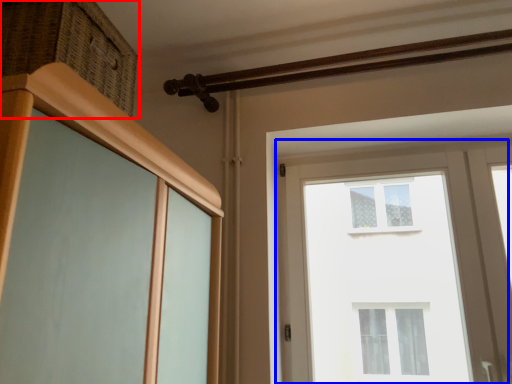
Question: Which point is further to the camera, drawer (highlighted by a red box) or window (highlighted by a blue box)?

Choices:
 (A) drawer
 (B) window

Answer: (B)